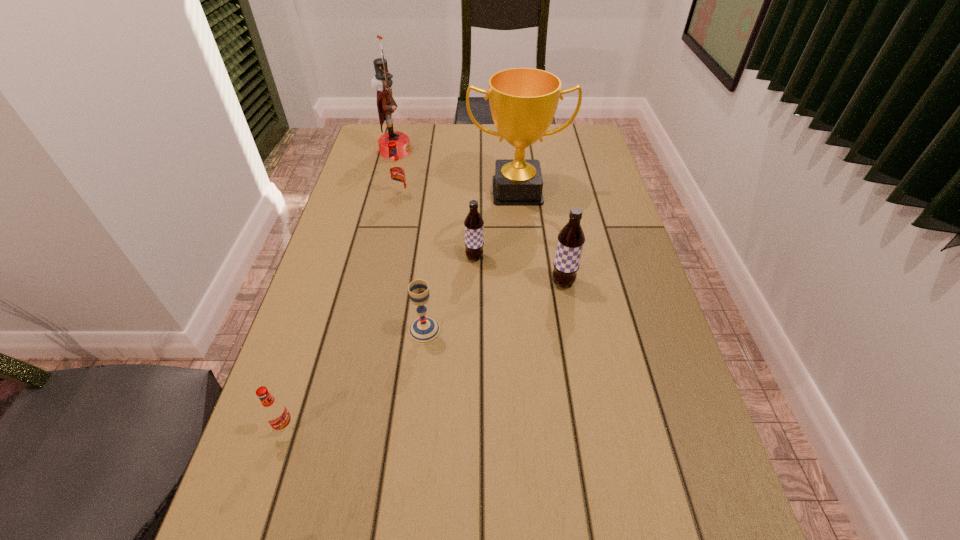
Find the location of `empty space between the nearest root beer and the award`. empty space between the nearest root beer and the award is located at coordinates 401,309.

At what (x,y) coordinates should I click in order to perform the action: click on blank region between the farther red root beer and the gold award. Please return your answer as a coordinate pair (x, y). Looking at the image, I should click on (459, 193).

At what (x,y) coordinates should I click in order to perform the action: click on free space between the gold award and the chalice. Please return your answer as a coordinate pair (x, y). This screenshot has width=960, height=540. Looking at the image, I should click on (471, 261).

Find the location of a particular element. This screenshot has width=960, height=540. vacant space that's between the red nutcracker and the nearer red root beer is located at coordinates (341, 289).

The image size is (960, 540). Find the location of `object that can be found as the closest to the farther red root beer`. object that can be found as the closest to the farther red root beer is located at coordinates (523, 101).

Identify which object is the fifth nearest to the second nearest object. Please provide its 2D coordinates. Your answer should be formatted as a tuple, i.e. [(x, y)], where the tuple contains the x and y coordinates of a point satisfying the conditions above.

[(396, 174)]

This screenshot has height=540, width=960. In order to click on root beer that is the closest to the bigger red root beer in this screenshot , I will do `click(473, 224)`.

Identify which root beer is the nearest to the nearer red root beer. Please provide its 2D coordinates. Your answer should be formatted as a tuple, i.e. [(x, y)], where the tuple contains the x and y coordinates of a point satisfying the conditions above.

[(473, 224)]

Image resolution: width=960 pixels, height=540 pixels. I want to click on brown root beer that is the closest to the nearer red root beer, so click(x=473, y=224).

Where is `free space that satisfies the following two spatial constraints: 1. on the front-facing side of the fourth farthest object; 2. on the right side of the farthest object`? The image size is (960, 540). free space that satisfies the following two spatial constraints: 1. on the front-facing side of the fourth farthest object; 2. on the right side of the farthest object is located at coordinates (369, 258).